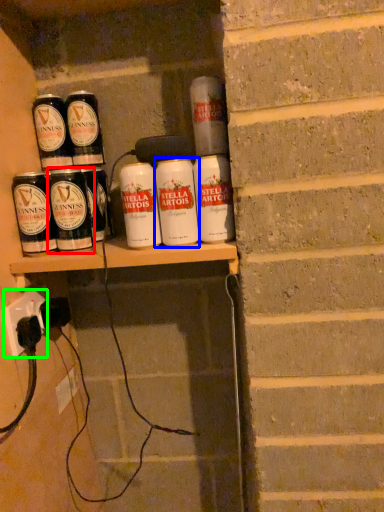
Question: Which object is the closest to the tin can (highlighted by a red box)? Choose among these: tin can (highlighted by a blue box) or electric outlet (highlighted by a green box).

Choices:
 (A) tin can
 (B) electric outlet

Answer: (B)